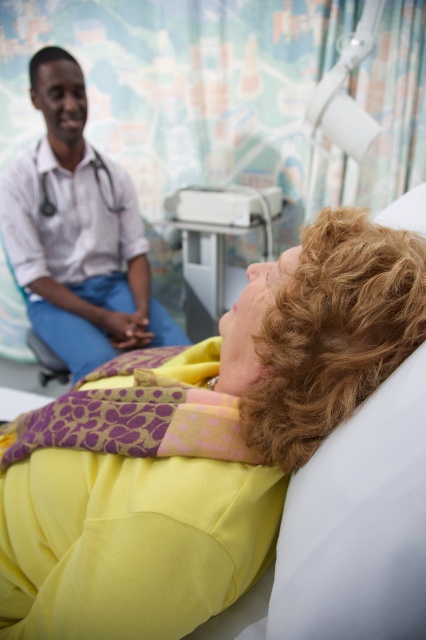
You are a nurse entering the room and need to place a medical kit on the largest object in the scene. Which object should you choose between the matte white shirt at left and the white plastic tray at center?

The matte white shirt at left is larger in size than the white plastic tray at center, so the nurse should place the medical kit on the matte white shirt at left.

You are a nurse entering the room and need to check the length of the yellow fabric at center and the matte white shirt at left. Which one is shorter?

The yellow fabric at center is shorter than the matte white shirt at left.

You are a nurse in the hospital room. You need to place a medical kit on the tallest object in the room. Which object should you choose between the matte white shirt at left and the white plastic tray at center?

The matte white shirt at left is taller than the white plastic tray at center, so you should place the medical kit on the matte white shirt at left.